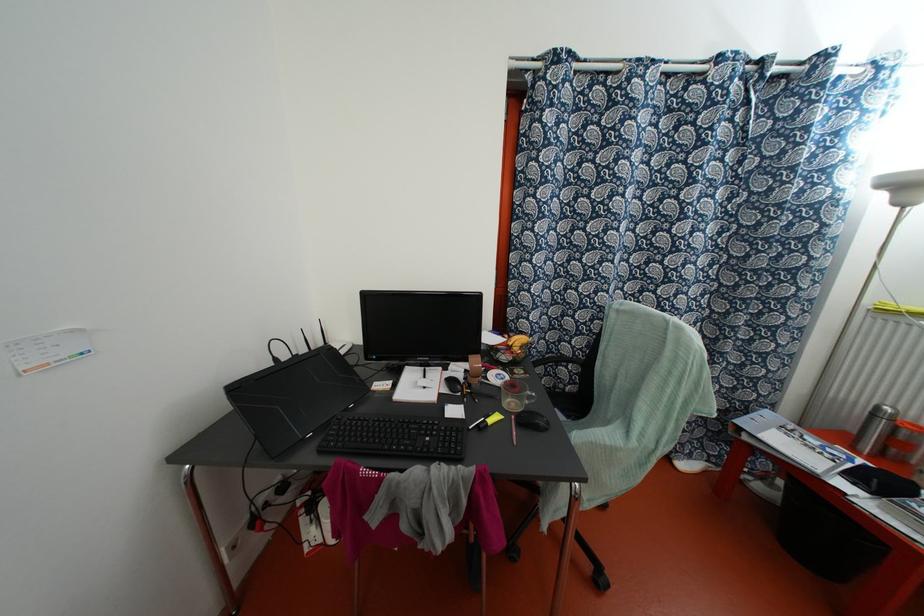
Where would you lift the white notepad? Please return your answer as a coordinate pair (x, y).

(418, 384)